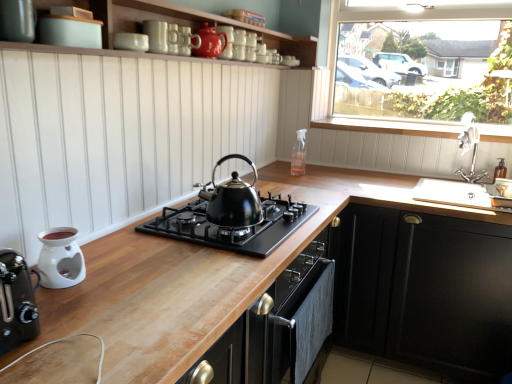
Image resolution: width=512 pixels, height=384 pixels. Identify the location of free location in front of clear glass spray bottle at upper center, the fourth appliance from the front. (314, 179).